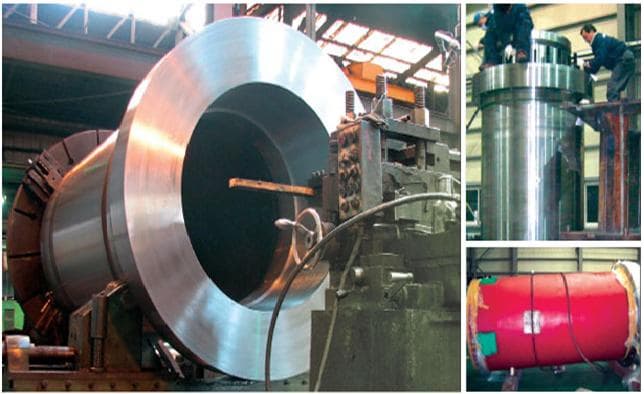
The image size is (644, 394). I want to click on lights, so click(156, 10), click(350, 38), click(381, 42), click(408, 54), click(437, 75), click(437, 65), click(330, 29), click(319, 21), click(196, 11).